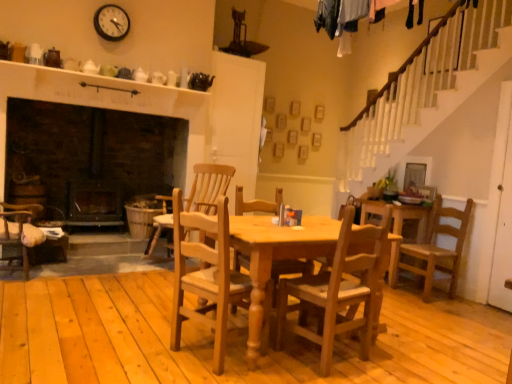
The image size is (512, 384). I want to click on unoccupied area in front of light brown wooden chair at right, the second chair from the back, so click(447, 311).